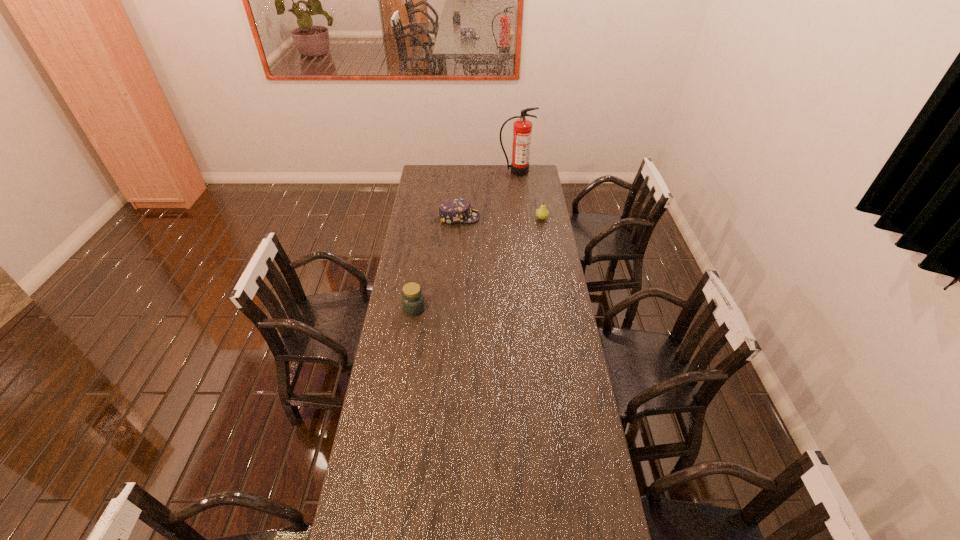
The height and width of the screenshot is (540, 960). Find the location of `fire extinguisher`. fire extinguisher is located at coordinates (522, 128).

At what (x,y) coordinates should I click in order to perform the action: click on the tallest object. Please return your answer as a coordinate pair (x, y). The height and width of the screenshot is (540, 960). Looking at the image, I should click on (522, 128).

Where is `the leftmost object`? the leftmost object is located at coordinates (413, 303).

The image size is (960, 540). What are the coordinates of `the third shortest object` in the screenshot? It's located at (413, 303).

Identify the location of pear. This screenshot has height=540, width=960. tap(542, 213).

Image resolution: width=960 pixels, height=540 pixels. I want to click on headwear, so click(x=455, y=210).

Where is `vacant space located on the front-facing side of the tallest object`? The height and width of the screenshot is (540, 960). vacant space located on the front-facing side of the tallest object is located at coordinates (518, 195).

This screenshot has height=540, width=960. In order to click on blank space located on the front of the third shortest object in this screenshot , I will do `click(411, 332)`.

You are a GUI agent. You are given a task and a screenshot of the screen. Output one action in this format:
    pyautogui.click(x=<x>, y=<y>)
    Task: Click on the free space located on the back of the pear
    
    Given the screenshot: What is the action you would take?
    pyautogui.click(x=540, y=202)

I want to click on free space located on the front-facing side of the third object from right to left, so click(x=504, y=217).